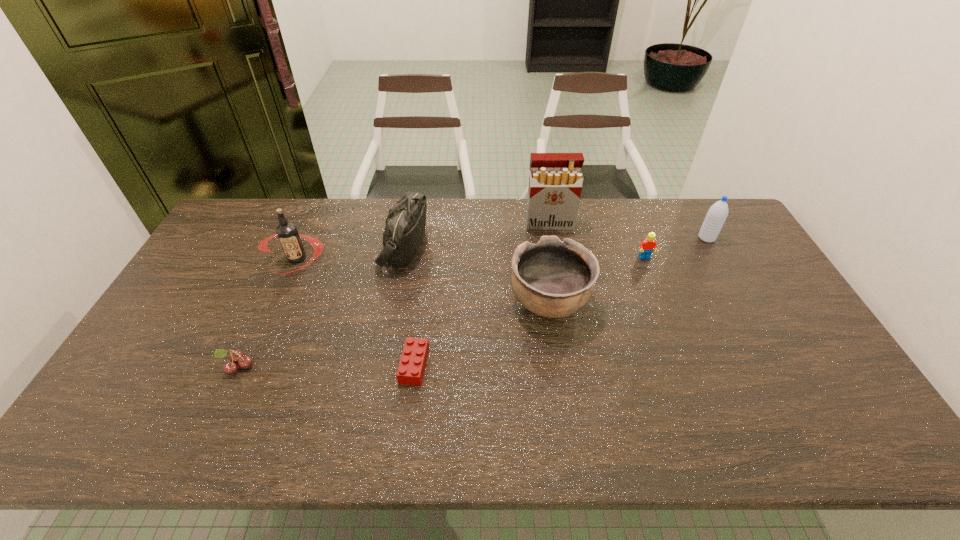
Where is `water bottle present at the far edge`? The height and width of the screenshot is (540, 960). water bottle present at the far edge is located at coordinates (717, 214).

Locate an element on the screen. This screenshot has width=960, height=540. object located in the right edge section of the desktop is located at coordinates (717, 214).

The image size is (960, 540). What are the coordinates of `object positioned at the far right corner` in the screenshot? It's located at (717, 214).

In the image, there is a desktop. Identify the location of vacant space at the far edge. Image resolution: width=960 pixels, height=540 pixels. (302, 227).

Identify the location of vacant region at the near edge of the desktop. (361, 440).

This screenshot has height=540, width=960. In the image, there is a desktop. Identify the location of free space at the left edge. (207, 254).

In the image, there is a desktop. Where is `free space at the right edge`? free space at the right edge is located at coordinates (844, 413).

Locate an element on the screen. vacant point at the far left corner is located at coordinates (242, 214).

This screenshot has height=540, width=960. In the image, there is a desktop. Find the location of `vacant space at the far right corner`. vacant space at the far right corner is located at coordinates (693, 227).

You are a GUI agent. You are given a task and a screenshot of the screen. Output one action in this format:
    pyautogui.click(x=<x>, y=<y>)
    Task: Click on the vacant space that is in between the cigarette case and the cherry
    
    Given the screenshot: What is the action you would take?
    pyautogui.click(x=394, y=296)